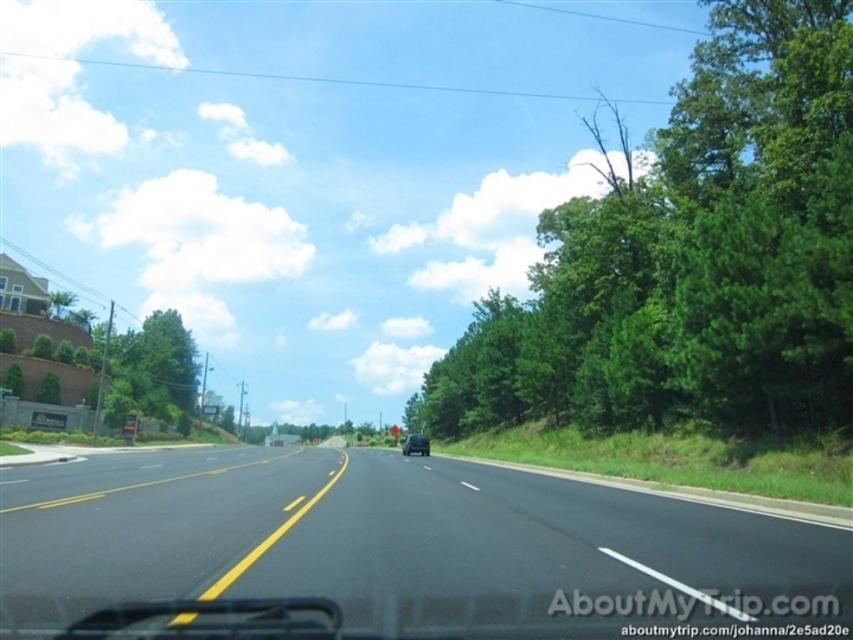
Question: Which point appears closest to the camera in this image?

Choices:
 (A) (747, 314)
 (B) (410, 451)

Answer: (A)

Question: Which point is closer to the camera taking this photo?

Choices:
 (A) (424, 451)
 (B) (445, 554)
 (C) (589, 413)

Answer: (B)

Question: Is black asphalt highway at center closer to camera compared to black matte car at center?

Choices:
 (A) no
 (B) yes

Answer: (B)

Question: From the image, what is the correct spatial relationship of green leafy tree at right in relation to black matte car at center?

Choices:
 (A) right
 (B) left

Answer: (A)

Question: Is black asphalt highway at center positioned at the back of black matte car at center?

Choices:
 (A) no
 (B) yes

Answer: (A)

Question: Which object is the closest to the black asphalt highway at center?

Choices:
 (A) black matte car at center
 (B) green leafy tree at right

Answer: (B)